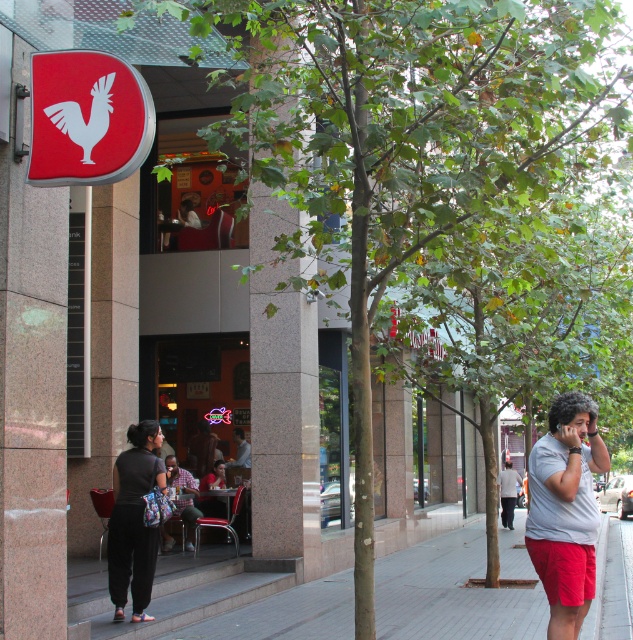
In the scene shown: Who is more forward, (558, 621) or (154, 448)?

Point (558, 621)

Does gray cotton t-shirt at center appear under dark gray fabric pants at lower left?

No, gray cotton t-shirt at center is not below dark gray fabric pants at lower left.

Does point (586, 470) come closer to viewer compared to point (120, 504)?

Yes, point (586, 470) is in front of point (120, 504).

Where is `gray cotton t-shirt at center`? gray cotton t-shirt at center is located at coordinates (565, 509).

Is concrete pavement at lower left shorter than dark gray fabric pants at lower left?

Incorrect, concrete pavement at lower left's height does not fall short of dark gray fabric pants at lower left's.

Does concrete pavement at lower left come in front of dark gray fabric pants at lower left?

Yes, concrete pavement at lower left is closer to the viewer.

Who is more forward, (308, 634) or (130, 564)?

Point (130, 564)

Identify the location of concrete pavement at lower left. This screenshot has height=640, width=633. point(451,595).

Does gray cotton t-shirt at center appear under white cotton shirt at right?

Actually, gray cotton t-shirt at center is above white cotton shirt at right.

Is point (565, 435) positioned before point (505, 506)?

Yes, it is in front of point (505, 506).

Locate an element on the screen. This screenshot has width=633, height=640. gray cotton t-shirt at center is located at coordinates (565, 509).